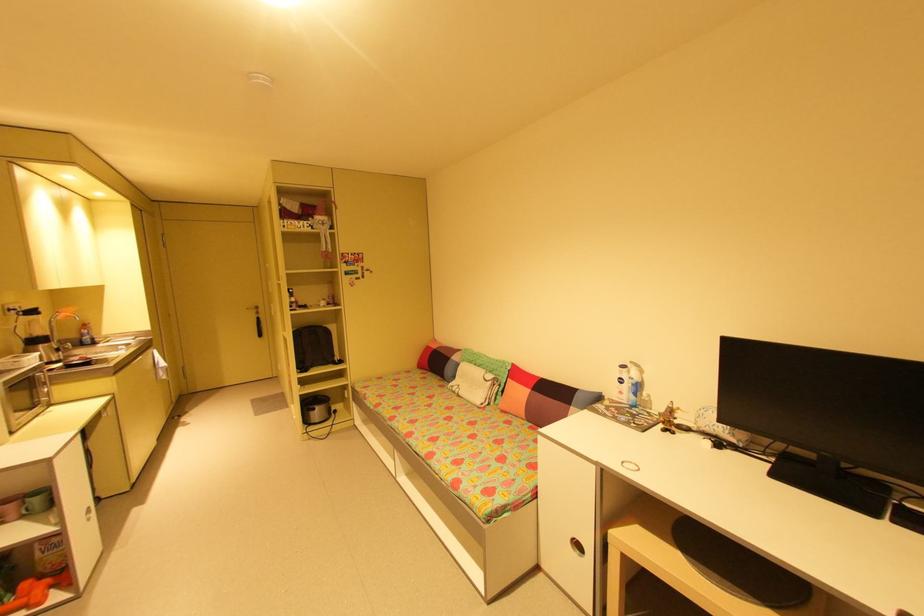
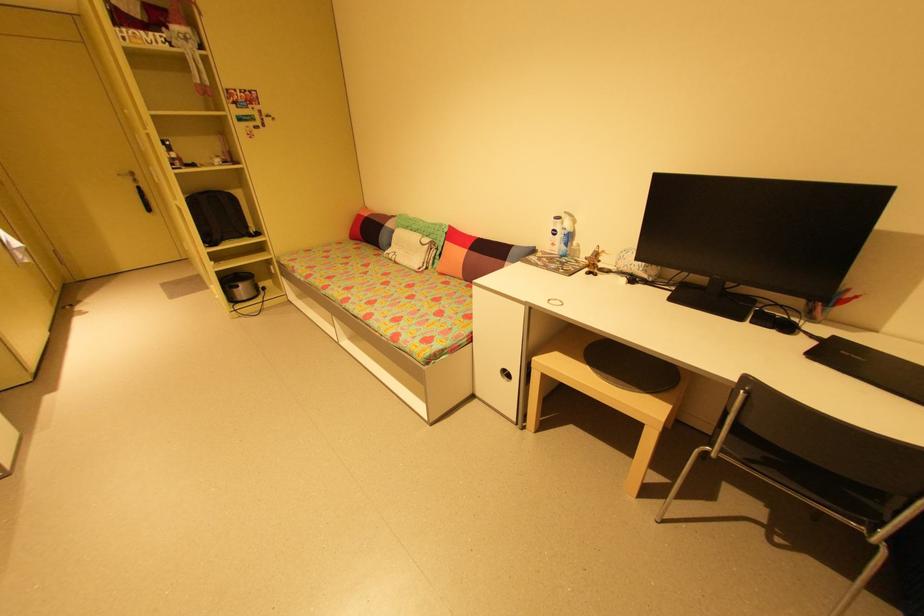
In the second image, find the point that corresponds to pixel 307 368 in the first image.

(215, 241)